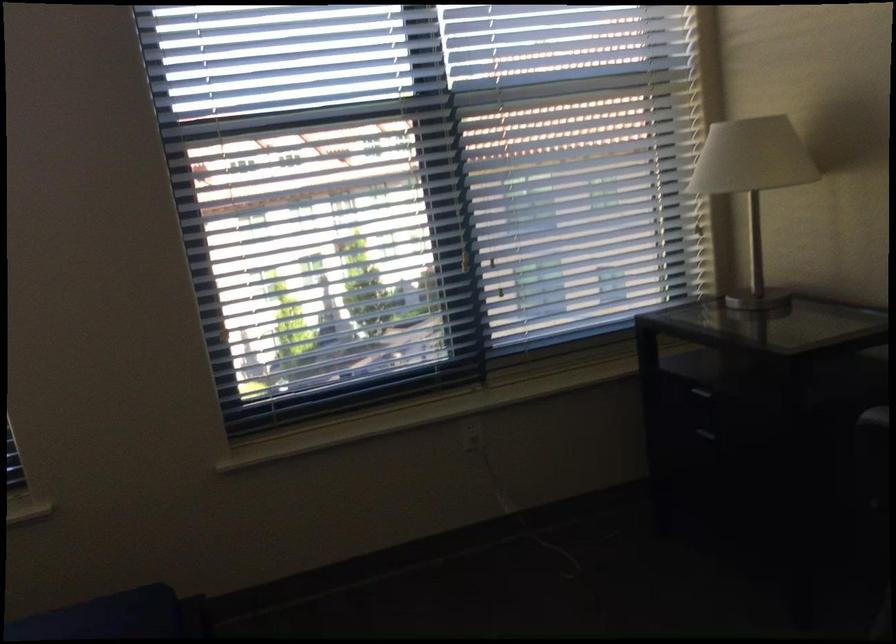
Identify the location of white electrical outlet. Image resolution: width=896 pixels, height=644 pixels. (471, 433).